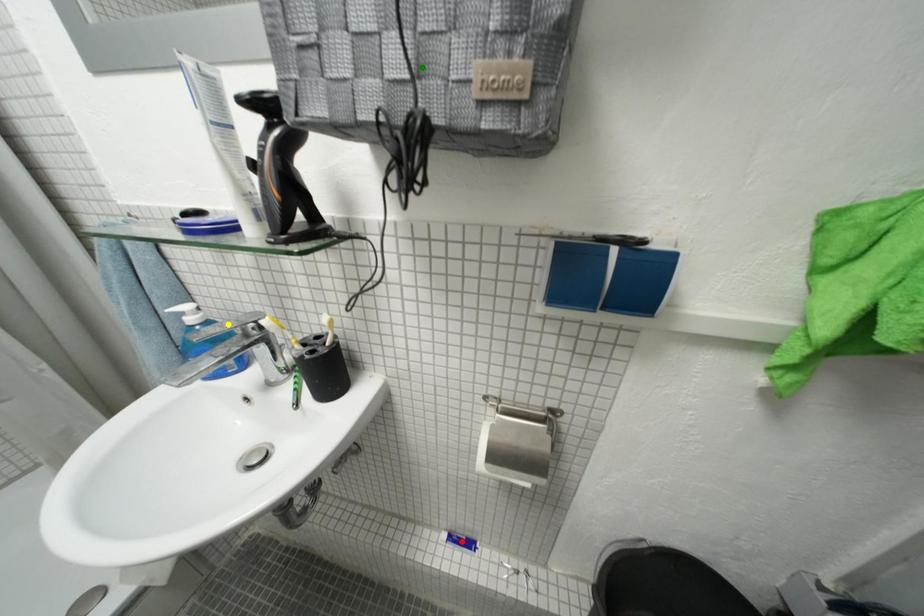
Order these from nearest to farthest:
1. yellow point
2. red point
3. green point

1. green point
2. yellow point
3. red point